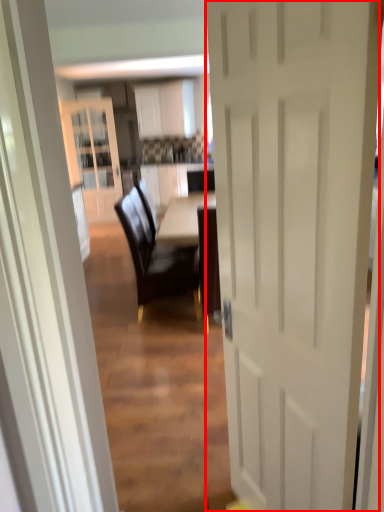
Question: From the image's perspective, what is the correct spatial relationship of door (annotated by the red box) in relation to chair?

Choices:
 (A) above
 (B) below

Answer: (B)